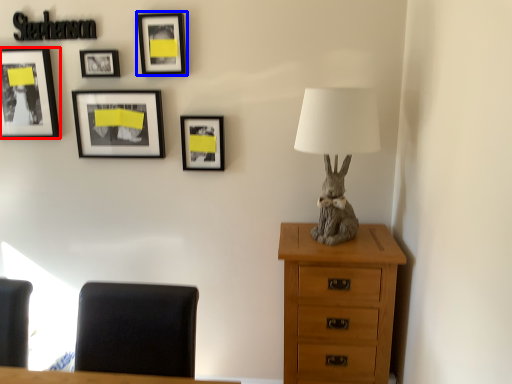
Question: Which object is further to the camera taking this photo, picture frame (highlighted by a red box) or picture frame (highlighted by a blue box)?

Choices:
 (A) picture frame
 (B) picture frame

Answer: (A)